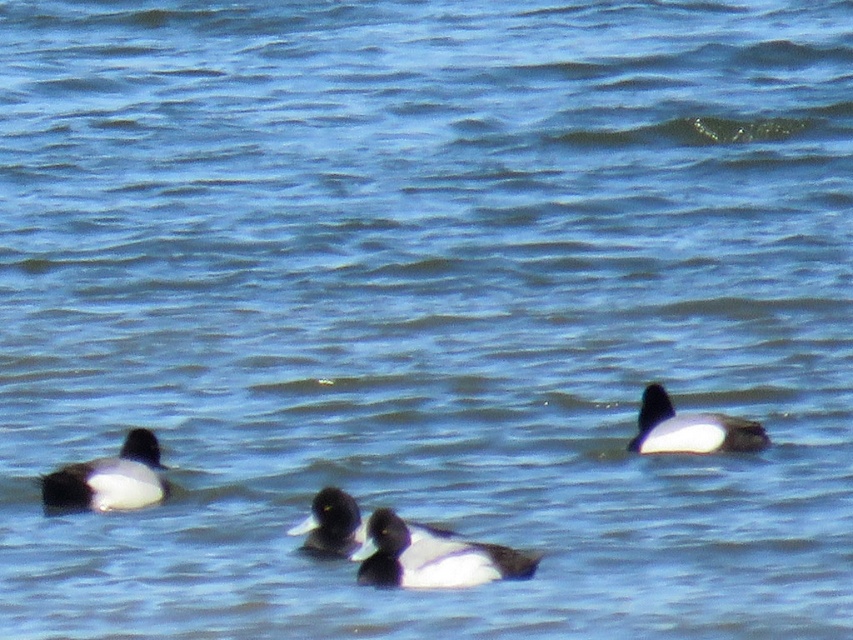
Question: Is white matte duck at left closer to camera compared to white matte duck at right?

Choices:
 (A) yes
 (B) no

Answer: (A)

Question: Can you confirm if white matte duck at left is positioned below white matte duck at center?

Choices:
 (A) yes
 (B) no

Answer: (B)

Question: Which of the following is the closest to the observer?

Choices:
 (A) (103, 458)
 (B) (639, 432)

Answer: (A)

Question: Does white matte duck at right appear under white matte duck at center?

Choices:
 (A) yes
 (B) no

Answer: (B)

Question: Considering the real-world distances, which object is farthest from the black matte duck at center?

Choices:
 (A) white matte duck at right
 (B) white matte duck at left
 (C) white matte duck at center

Answer: (A)

Question: Which object is closer to the camera taking this photo?

Choices:
 (A) white matte duck at left
 (B) black matte duck at center
 (C) white matte duck at center
 (D) white matte duck at right

Answer: (B)